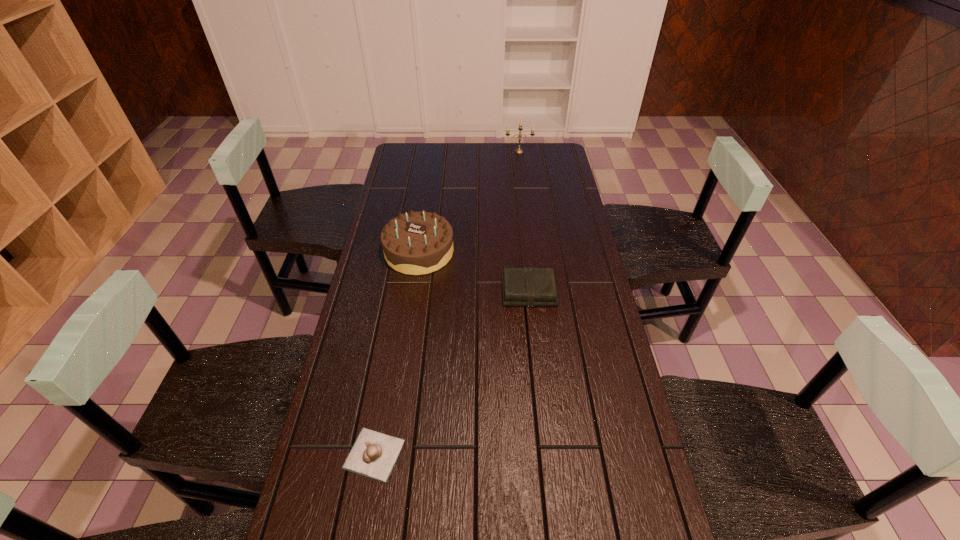
Find the location of a particular element. This screenshot has width=960, height=540. free space at the right edge of the desktop is located at coordinates (566, 206).

The width and height of the screenshot is (960, 540). What are the coordinates of `vacant space at the far right corner` in the screenshot? It's located at (538, 150).

At what (x,y) coordinates should I click in order to perform the action: click on vacant space that's between the farthest object and the nearest object. Please return your answer as a coordinate pair (x, y). The height and width of the screenshot is (540, 960). Looking at the image, I should click on (446, 303).

This screenshot has width=960, height=540. I want to click on free space between the second shortest object and the shortest object, so click(451, 373).

I want to click on free area in between the third tallest object and the farthest object, so click(524, 221).

Locate an element on the screen. This screenshot has width=960, height=540. vacant area that lies between the garlic and the second nearest object is located at coordinates (451, 373).

Locate an element on the screen. This screenshot has height=540, width=960. free space between the birthday cake and the farthest object is located at coordinates (469, 201).

This screenshot has width=960, height=540. I want to click on unoccupied area between the candle and the third farthest object, so click(524, 221).

Locate an element on the screen. The image size is (960, 540). empty space between the garlic and the second tallest object is located at coordinates (396, 353).

Locate an element on the screen. This screenshot has height=540, width=960. free space between the farthest object and the third shortest object is located at coordinates (469, 201).